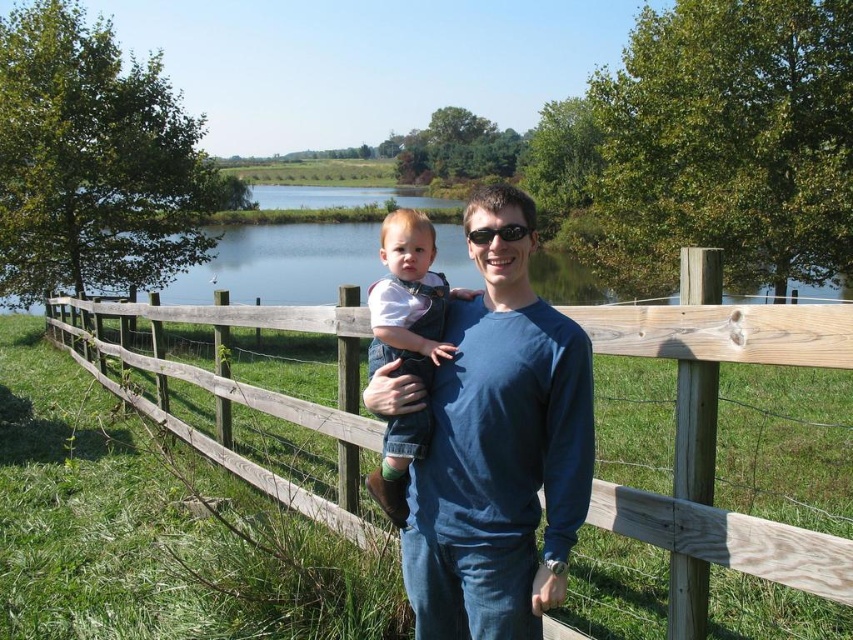
You are standing in the serene outdoor scene described. If you want to take a photo of the wooden fence at center, where should you aim your camera based on the coordinates provided?

You should aim your camera at point (714, 442) to capture the wooden fence at center as specified.

You are a photographer trying to capture a photo of the wooden fence at center and the denim overall at center. Which object should you focus on first to ensure both are in sharp focus?

The wooden fence at center is closer to the viewer than the denim overall at center, so you should focus on the wooden fence at center first to ensure both are in sharp focus.